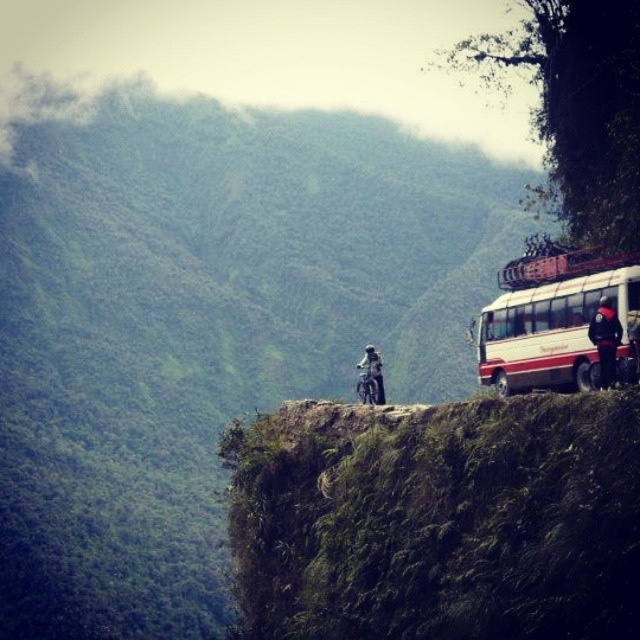
Identify the location of white matte bus at right. (554, 324).

Does white matte bus at right appear on the left side of dark gray fabric jacket at center?

Incorrect, white matte bus at right is not on the left side of dark gray fabric jacket at center.

Is point (529, 342) less distant than point (374, 353)?

Yes, it is.

Identify the location of white matte bus at right. The width and height of the screenshot is (640, 640). (554, 324).

Can you confirm if green grassy cliff at upper right is positioned to the left of dark gray fabric jacket at center?

Correct, you'll find green grassy cliff at upper right to the left of dark gray fabric jacket at center.

Which is behind, point (632, 432) or point (380, 403)?

Point (380, 403)

Which is in front, point (528, 616) or point (362, 387)?

Positioned in front is point (528, 616).

Where is `green grassy cliff at upper right`? The height and width of the screenshot is (640, 640). green grassy cliff at upper right is located at coordinates (438, 522).

Who is more distant from viewer, (x=236, y=540) or (x=602, y=356)?

Point (x=236, y=540)

Can you confirm if green grassy cliff at upper right is positioned to the left of dark blue jacket at right?

Correct, you'll find green grassy cliff at upper right to the left of dark blue jacket at right.

Does point (308, 605) come behind point (600, 358)?

Yes, it is behind point (600, 358).

Find the location of a particular element. The image size is (640, 640). green grassy cliff at upper right is located at coordinates click(x=438, y=522).